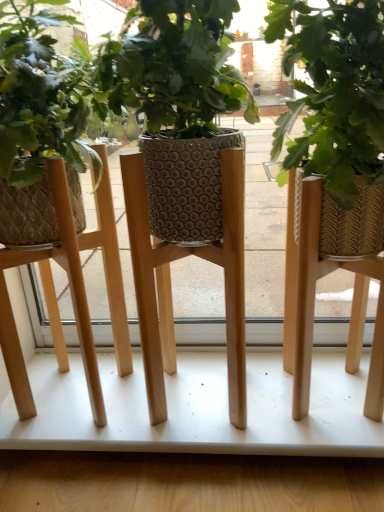
At what (x,y) coordinates should I click in order to perform the action: click on vacant space underneath wooden stool at center (from a real-world perspective). Please return your answer as a coordinate pair (x, y). This screenshot has width=384, height=512. Looking at the image, I should click on (77, 396).